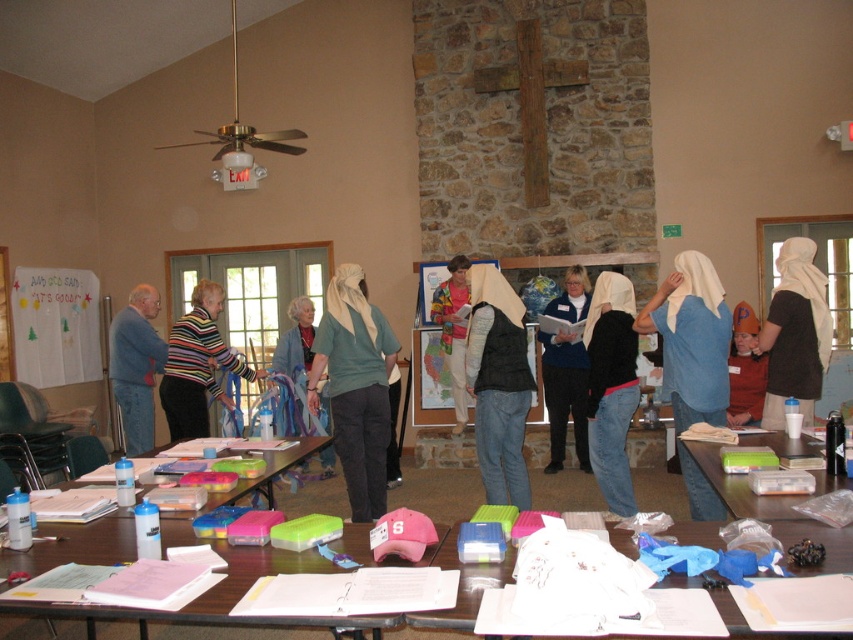
You are organizing a clothing donation drive and need to sort items by size. You have a blue cotton shirt at center and a blue fleece vest at center. Which item should you place in the large size bin?

The blue cotton shirt at center has a larger size compared to the blue fleece vest at center, so it should be placed in the large size bin.

Based on the coordinates provided, where is the blue cotton shirt at center located in the image?

The blue cotton shirt at center is located at coordinates point (691,339).

You are standing at the entrance of the room and see the blue denim jacket at left. If you walk straight ahead, will the jacket be to your left or right?

The blue denim jacket at left is located at point 0.573 on the x and 0.161 on the y. Since you are facing forward, the jacket is to your left side.